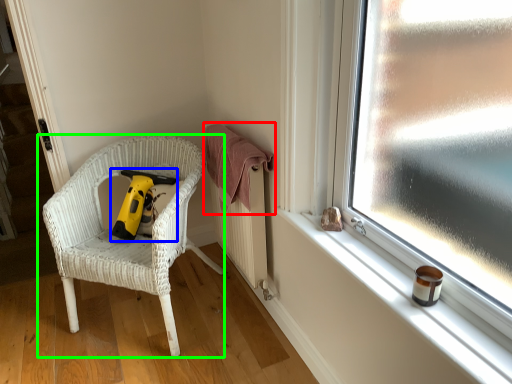
Question: Based on their relative distances, which object is farther from clothe (highlighted by a red box)? Choose from vacuum (highlighted by a blue box) and chair (highlighted by a green box).

Choices:
 (A) vacuum
 (B) chair

Answer: (B)